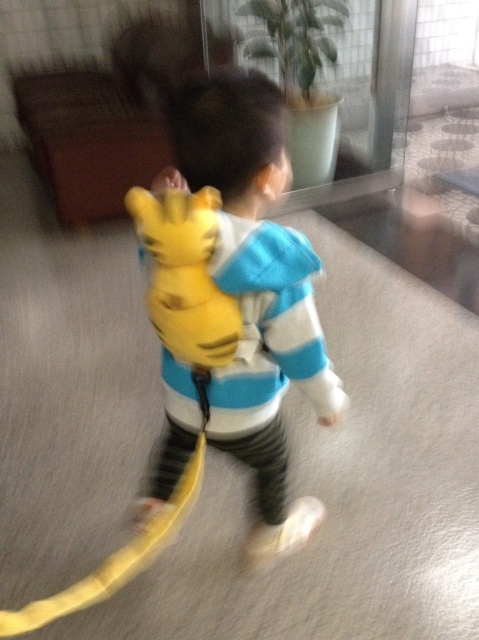
Question: Which point appears farthest from the camera in this image?

Choices:
 (A) (170, 269)
 (B) (264, 406)

Answer: (B)

Question: Observing the image, what is the correct spatial positioning of yellow plush backpack at center in reference to yellow plush toy at back?

Choices:
 (A) right
 (B) left

Answer: (A)

Question: Which point is farther to the camera?

Choices:
 (A) (285, 243)
 (B) (228, 355)

Answer: (B)

Question: Can you confirm if yellow plush backpack at center is positioned to the left of yellow plush toy at back?

Choices:
 (A) no
 (B) yes

Answer: (A)

Question: Which point is farther to the camera?

Choices:
 (A) yellow plush toy at back
 (B) yellow plush backpack at center

Answer: (B)

Question: Does yellow plush backpack at center appear on the left side of yellow plush toy at back?

Choices:
 (A) no
 (B) yes

Answer: (A)